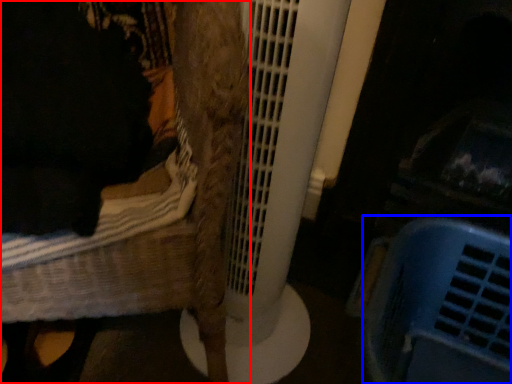
Question: Which point is closer to the camera, furniture (highlighted by a red box) or basket (highlighted by a blue box)?

Choices:
 (A) furniture
 (B) basket

Answer: (A)